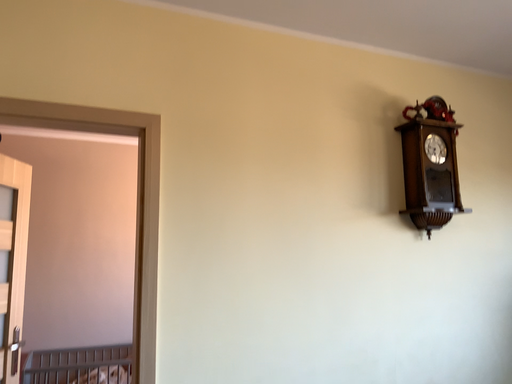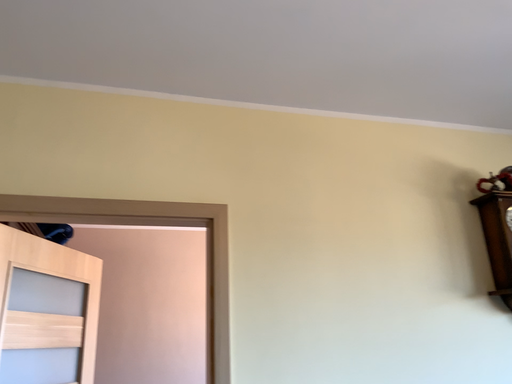
Question: Which way did the camera rotate in the video?

Choices:
 (A) rotated downward
 (B) rotated upward

Answer: (B)